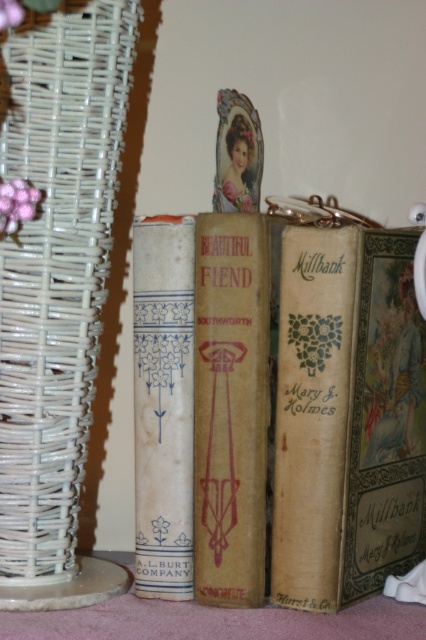
You are organizing a bookshelf and need to place the white wicker basket at left and the blue paper book at center. According to the scene, which object is positioned to the left of the other?

The white wicker basket at left is to the left of the blue paper book at center.

You are standing 3 feet away from the vintage books displayed on the light pink fabric surface. You want to reach the matte brown book at center to read its title. Can you comfortably reach it without moving your position?

The matte brown book at center is 26.98 inches away from the camera. Since 26.98 inches is approximately 2.25 feet, and you are standing 3 feet away from the books, the distance between you and the book is about 0.75 feet. This distance is too far to comfortably reach the matte brown book at center without moving closer.

You are organizing a bookshelf and need to place the white wicker basket at left and the blue paper book at center. Given their sizes, which item should you place first to ensure both fit properly?

The white wicker basket at left is larger in size than the blue paper book at center, so you should place the white wicker basket at left first to ensure there is enough space for both items.